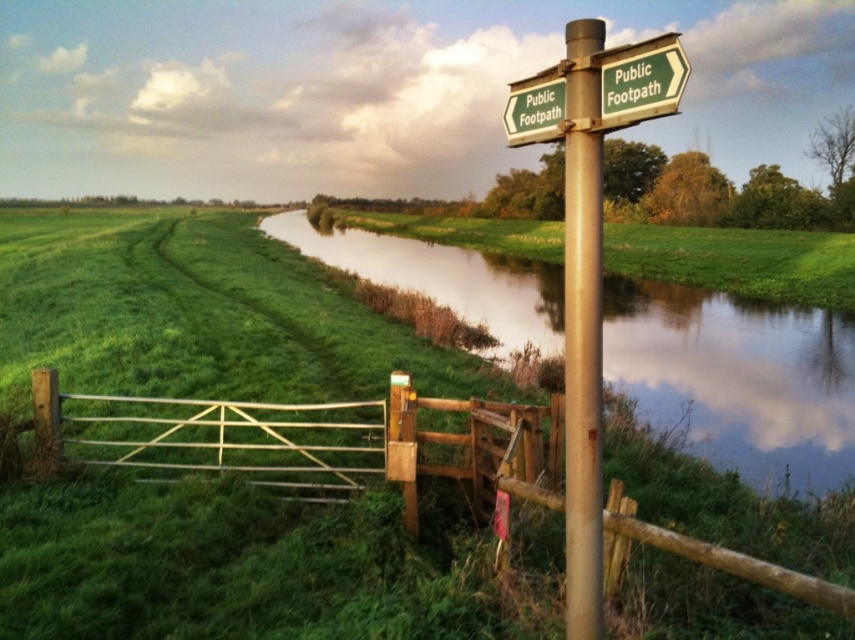
You are standing at the wooden gate in the scene. You see the green grassy river at center and the green grassy at center. Which one is closer to you?

Both the green grassy river at center and the green grassy at center are the same location, so they are equally close to you.

You are a hiker who wants to take a photo of the green grassy at center and the green wooden signpost at upper right. Since you have a wide angle lens, you want to fit both objects in the frame. Which object should you position closer to the center of the photo to ensure both are visible?

The green grassy at center is larger in size than the green wooden signpost at upper right. To fit both in the frame, position the green grassy at center closer to the center of the photo so that its larger size can be accommodated while still including the smaller green wooden signpost at upper right in the shot.

You are standing at the point marked by coordinates point (334,442) in a rural scene. What object is located exactly at this coordinate?

The wooden gate at center is located exactly at point (334,442).